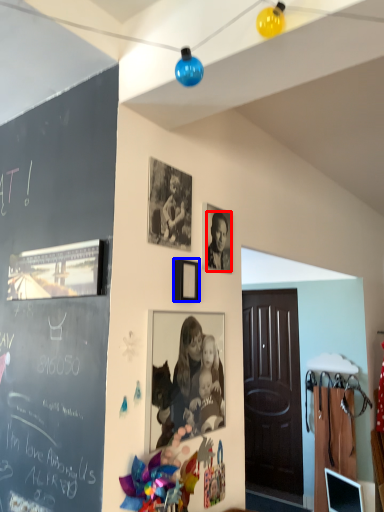
Question: Among these objects, which one is nearest to the camera, person (highlighted by a red box) or picture frame (highlighted by a blue box)?

Choices:
 (A) person
 (B) picture frame

Answer: (B)